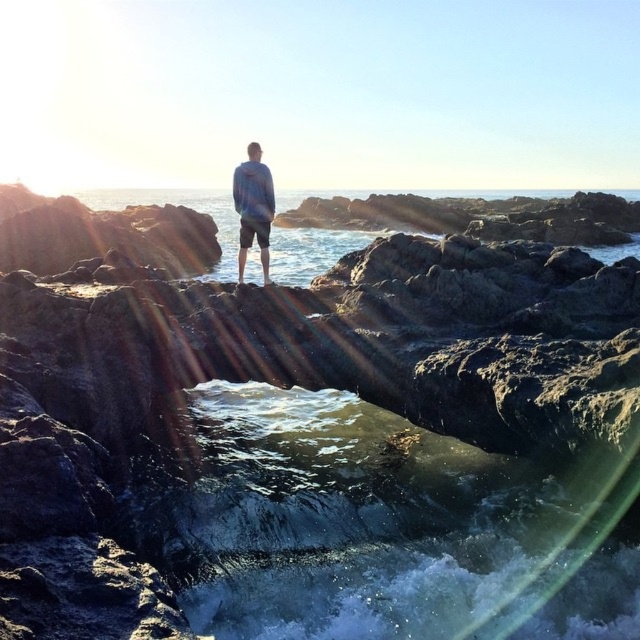
You are a hiker who wants to place your blue cotton hoodie at center on top of the rough textured rock at center. Based on the scene, will the hoodie stay balanced and not fall off?

The rough textured rock at center has a greater height compared to blue cotton hoodie at center. Since the rock is taller, the hoodie can be placed on top and should stay balanced as long as the surface is stable.

You are a hiker who wants to place your blue cotton hoodie at center on top of the rough textured rock at center. Based on the scene, will the hoodie fit on the rock?

The rough textured rock at center has a larger size compared to blue cotton hoodie at center, so the hoodie will fit on the rock.

You are standing on the beach and see the rough textured rock at center and the blue cotton hoodie at center. Which object is closer to the water?

The rough textured rock at center is located below the blue cotton hoodie at center, so it is closer to the water.